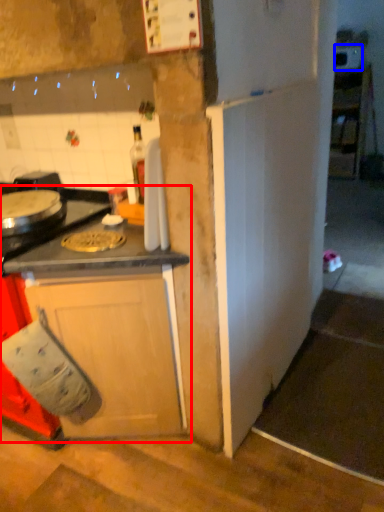
Question: Among these objects, which one is nearest to the camera, cabinetry (highlighted by a red box) or appliance (highlighted by a blue box)?

Choices:
 (A) cabinetry
 (B) appliance

Answer: (A)